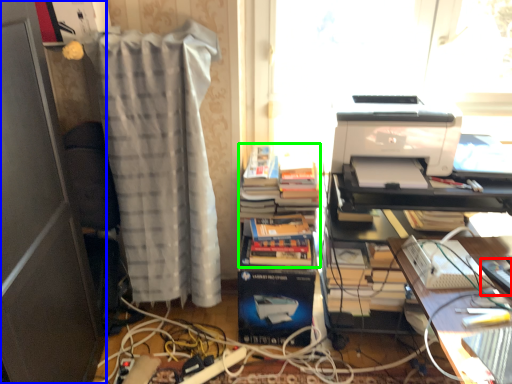
Question: Which object is the closest to the equipment (highlighted by a red box)? Choose among these: file cabinet (highlighted by a blue box) or book (highlighted by a green box).

Choices:
 (A) file cabinet
 (B) book

Answer: (B)